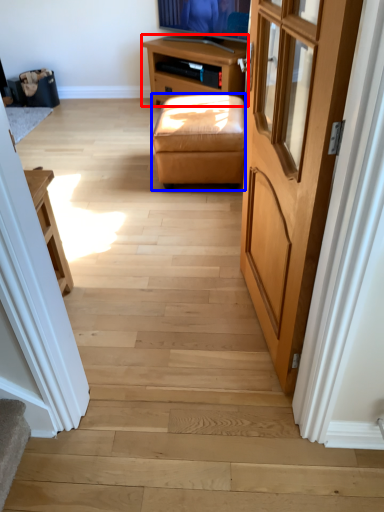
Question: Which object is further to the camera taking this photo, table (highlighted by a red box) or stool (highlighted by a blue box)?

Choices:
 (A) table
 (B) stool

Answer: (A)